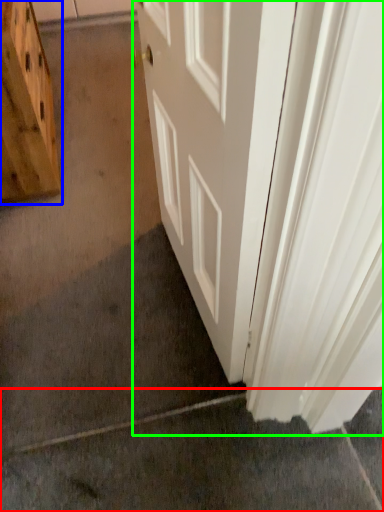
Question: Which is farther away from concrete (highlighted by a red box)? cabinetry (highlighted by a blue box) or door (highlighted by a green box)?

Choices:
 (A) cabinetry
 (B) door

Answer: (A)